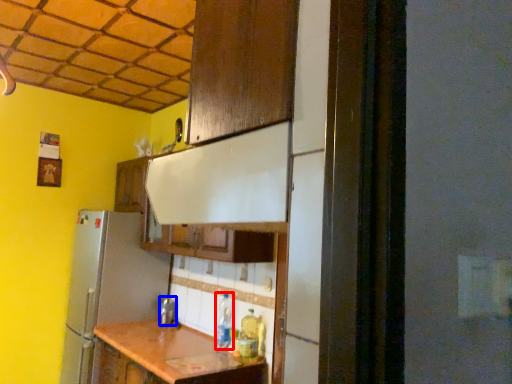
Question: Which of the following is the farthest to the observer, bottle (highlighted by a red box) or silver (highlighted by a blue box)?

Choices:
 (A) bottle
 (B) silver

Answer: (B)